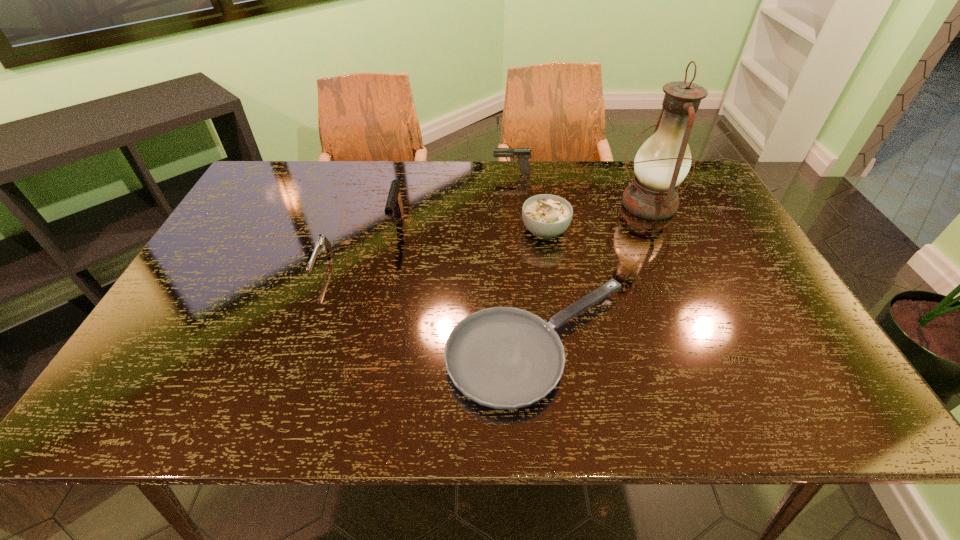
Image resolution: width=960 pixels, height=540 pixels. In order to click on vacant region at the near right corner of the desktop in this screenshot , I will do `click(846, 410)`.

I want to click on free point between the nearest object and the oil lamp, so click(x=594, y=275).

Where is `empty location between the second farthest pistol and the rightmost pistol`? This screenshot has width=960, height=540. empty location between the second farthest pistol and the rightmost pistol is located at coordinates point(454,199).

The image size is (960, 540). Find the location of `free spot between the second shortest pistol and the second nearest pistol`. free spot between the second shortest pistol and the second nearest pistol is located at coordinates (454, 199).

You are a GUI agent. You are given a task and a screenshot of the screen. Output one action in this format:
    pyautogui.click(x=<x>, y=<y>)
    Task: Click on the blank region between the shortest object and the second shortest object
    The width and height of the screenshot is (960, 540).
    Given the screenshot: What is the action you would take?
    pyautogui.click(x=431, y=305)

This screenshot has height=540, width=960. I want to click on vacant area between the farthest object and the second tallest object, so click(x=454, y=199).

Locate an element on the screen. The height and width of the screenshot is (540, 960). vacant point located between the rightmost pistol and the nearest object is located at coordinates (525, 259).

Identify the location of free area in between the second farthest pistol and the leftmost object. (360, 245).

At what (x,y) coordinates should I click in order to perform the action: click on free space between the shortest pistol and the rightmost pistol. Please return your answer as a coordinate pair (x, y). Looking at the image, I should click on (417, 219).

The image size is (960, 540). Find the location of `vacant area that lies between the nearest object and the soup bowl`. vacant area that lies between the nearest object and the soup bowl is located at coordinates (542, 288).